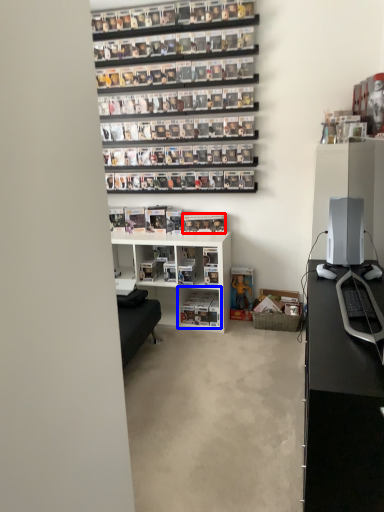
Question: Which point is further to the camera, book (highlighted by a red box) or shelf (highlighted by a blue box)?

Choices:
 (A) book
 (B) shelf

Answer: (A)